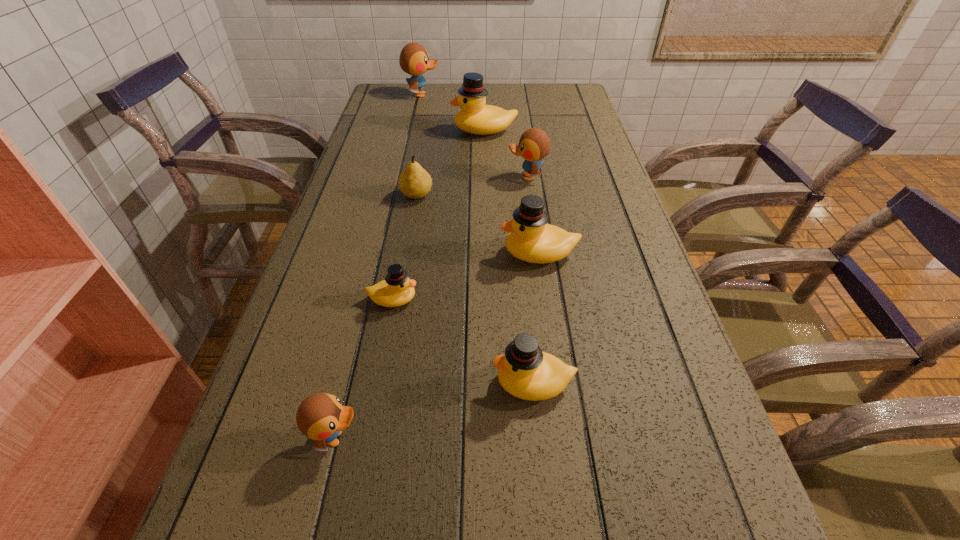
Locate which object is the sixth closest to the nearest duck. Please provide its 2D coordinates. Your answer should be formatted as a tuple, i.e. [(x, y)], where the tuple contains the x and y coordinates of a point satisfying the conditions above.

[(475, 117)]

I want to click on duck that stands as the third closest to the pear, so click(x=475, y=117).

This screenshot has height=540, width=960. What are the coordinates of `duck that is the third closest to the nearest object` in the screenshot? It's located at (531, 239).

At what (x,y) coordinates should I click in order to perform the action: click on blue duck that is the closest to the rightmost blue duck. Please return your answer as a coordinate pair (x, y). Looking at the image, I should click on (414, 60).

Find the location of a particular element. This screenshot has height=540, width=960. the second closest blue duck to the farthest yellow duck is located at coordinates (414, 60).

The width and height of the screenshot is (960, 540). I want to click on yellow duck that is the fourth nearest to the pear, so click(525, 372).

Identify which yellow duck is the second closest to the pear. Please provide its 2D coordinates. Your answer should be formatted as a tuple, i.e. [(x, y)], where the tuple contains the x and y coordinates of a point satisfying the conditions above.

[(475, 117)]

Identify the location of free location that satisfies the following two spatial constraints: 1. on the front side of the pear; 2. on the front-facing side of the shortest duck. (398, 299).